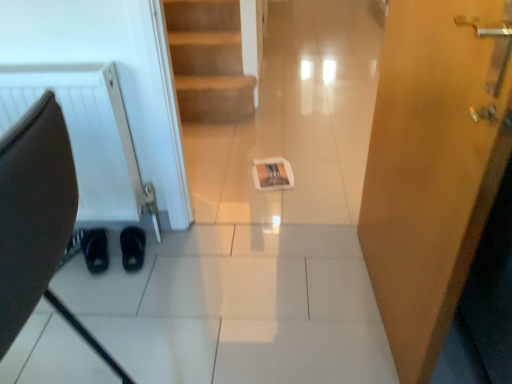
At what (x,y) coordinates should I click in order to perform the action: click on free space that is to the left of matte paper magazine at center. Please return your answer as a coordinate pair (x, y). This screenshot has height=384, width=512. Looking at the image, I should click on (229, 178).